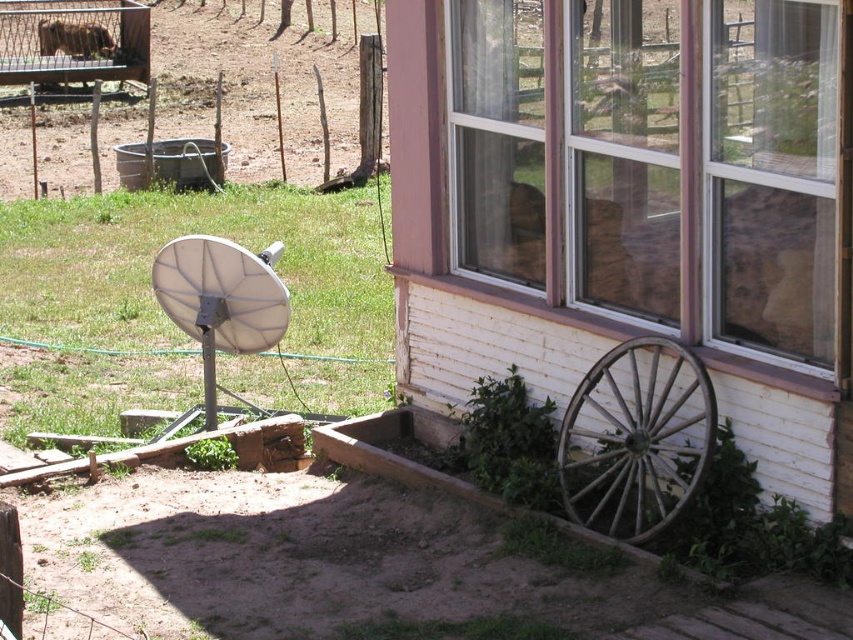
Question: Is the position of clear glass window at lower right more distant than that of white matte satellite dish at left?

Choices:
 (A) no
 (B) yes

Answer: (A)

Question: From the image, what is the correct spatial relationship of white matte satellite dish at left in relation to brown fur dog at upper left?

Choices:
 (A) below
 (B) above

Answer: (A)

Question: Which of the following is the closest to the observer?

Choices:
 (A) brown wooden wagon at upper left
 (B) clear glass window at lower right
 (C) weathered wood wagon wheel at lower right

Answer: (B)

Question: Which of the following is the farthest from the observer?

Choices:
 (A) (569, 12)
 (B) (44, 22)
 (C) (234, 275)
 (D) (109, 17)

Answer: (D)

Question: Which object is closer to the camera taking this photo?

Choices:
 (A) white matte satellite dish at left
 (B) weathered wood wagon wheel at lower right
 (C) clear glass window at lower right

Answer: (C)

Question: Is the position of clear glass window at lower right less distant than that of brown wooden wagon at upper left?

Choices:
 (A) no
 (B) yes

Answer: (B)